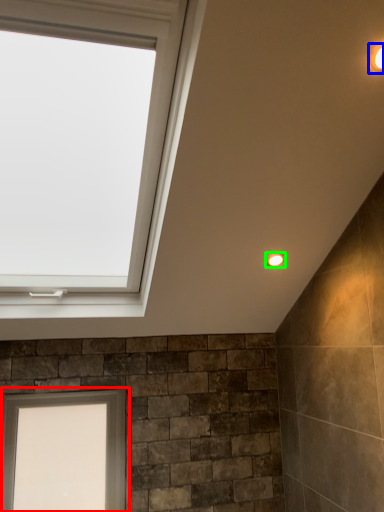
Question: Which object is positioned closest to window (highlighted by a red box)? Select from light fixture (highlighted by a blue box) and light fixture (highlighted by a green box).

Choices:
 (A) light fixture
 (B) light fixture

Answer: (B)